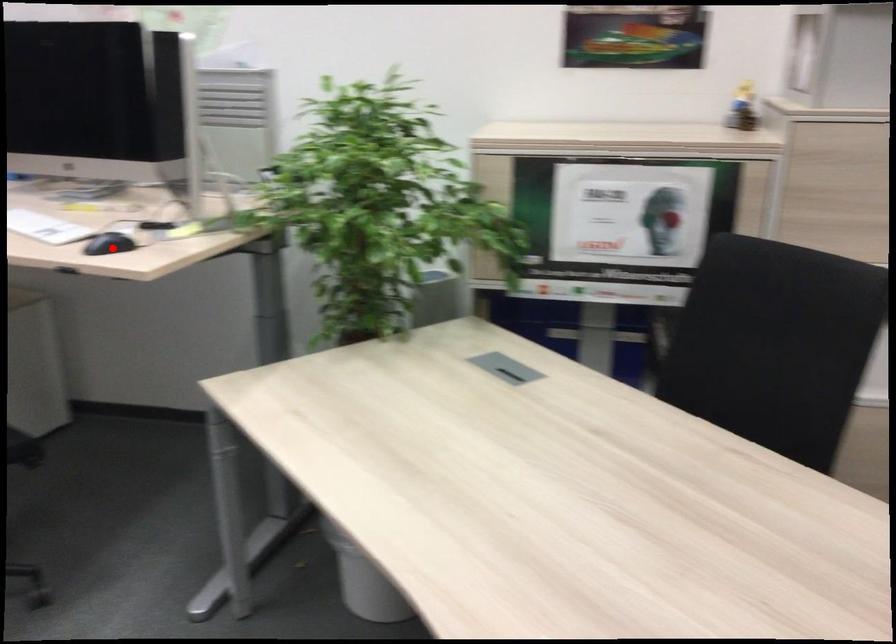
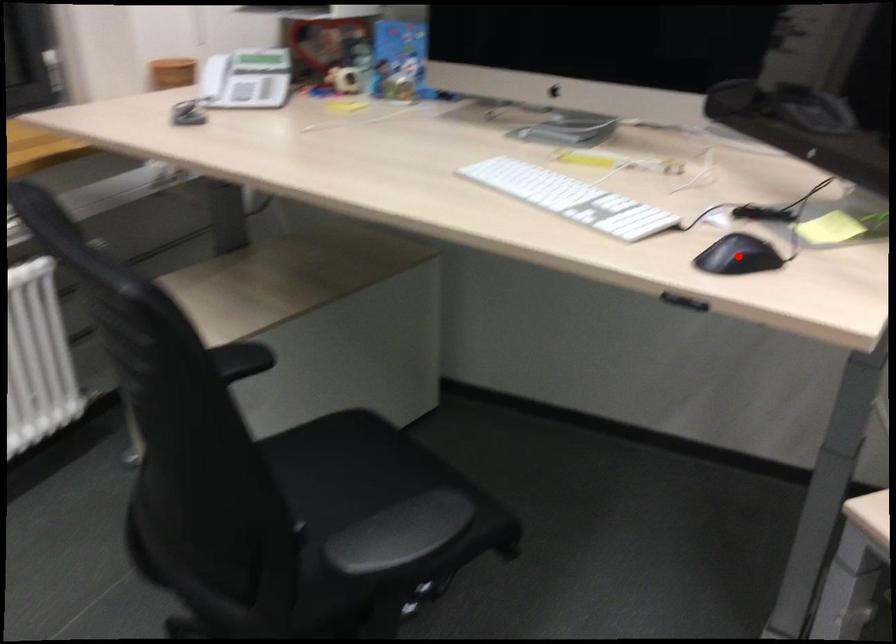
I am providing you with two images of the same scene from different viewpoints. A red point is marked on the first image and another point is marked on the second image. Do the highlighted points in image1 and image2 indicate the same real-world spot?

Yes